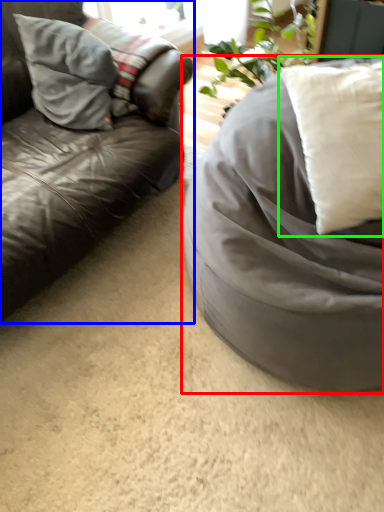
Question: Which is farther away from furniture (highlighted by a red box)? studio couch (highlighted by a blue box) or pillow (highlighted by a green box)?

Choices:
 (A) studio couch
 (B) pillow

Answer: (A)